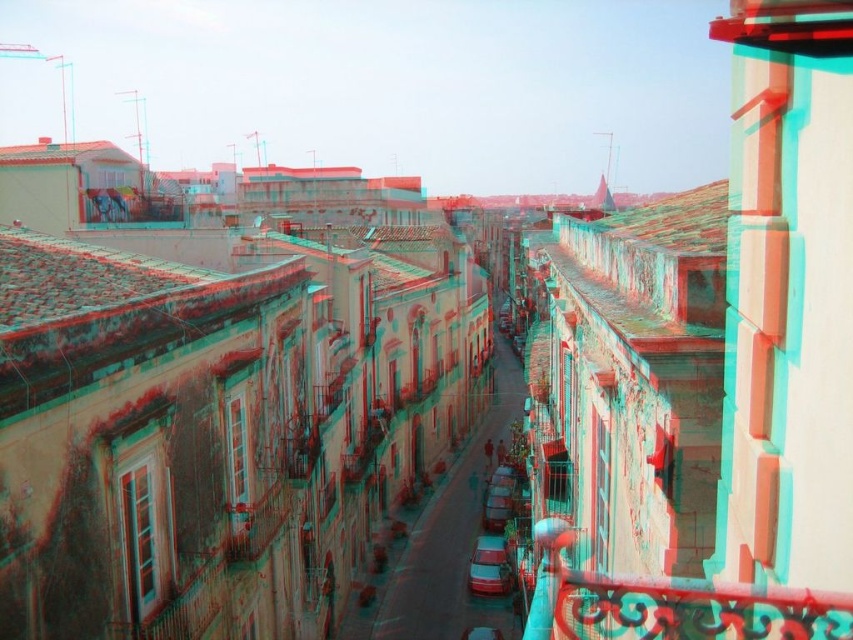
Question: Can you confirm if polished metal railing at center right is bigger than shiny red car at center?

Choices:
 (A) yes
 (B) no

Answer: (A)

Question: Which of the following is the farthest from the observer?

Choices:
 (A) metallic silver car at center
 (B) shiny red car at center

Answer: (B)

Question: Does polished metal railing at center right have a greater width compared to shiny red car at center?

Choices:
 (A) no
 (B) yes

Answer: (A)

Question: Which point is closer to the camera?

Choices:
 (A) shiny red car at center
 (B) polished metal railing at center right

Answer: (B)

Question: Which of these objects is positioned closest to the metallic silver car at center?

Choices:
 (A) shiny red car at center
 (B) polished metal railing at center right

Answer: (A)

Question: Considering the relative positions of polished metal railing at center right and metallic silver car at center in the image provided, where is polished metal railing at center right located with respect to metallic silver car at center?

Choices:
 (A) below
 (B) above

Answer: (B)